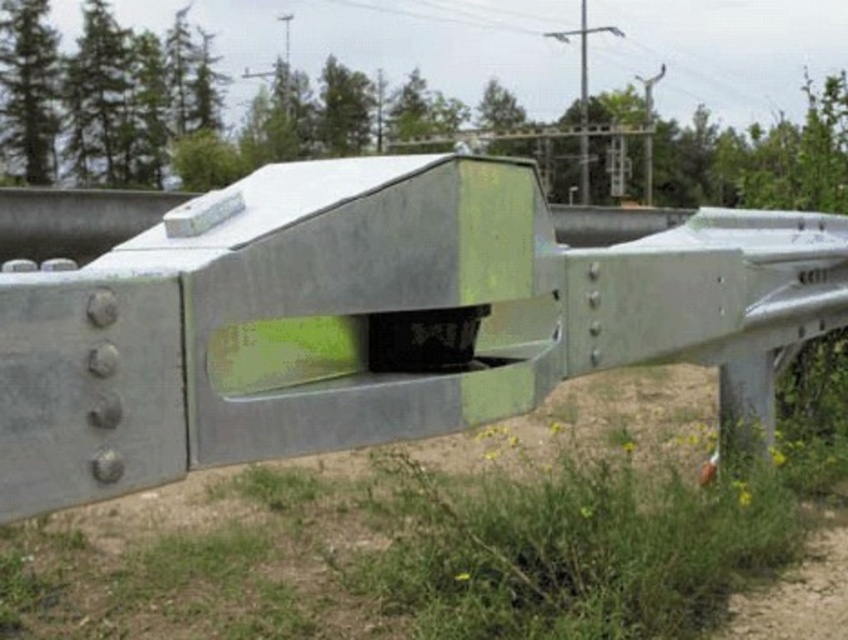
Does dirt track at lower center appear over green grass at lower right?

No.

Is dirt track at lower center below green grass at lower right?

Indeed, dirt track at lower center is positioned under green grass at lower right.

Locate an element on the screen. Image resolution: width=848 pixels, height=640 pixels. dirt track at lower center is located at coordinates (455, 536).

At what (x,y) coordinates should I click in order to perform the action: click on dirt track at lower center. Please return your answer as a coordinate pair (x, y). This screenshot has width=848, height=640. Looking at the image, I should click on (455, 536).

Who is more distant from viewer, (548,392) or (706,621)?

Positioned behind is point (706,621).

Between green matte metal rail at center and dirt track at lower center, which one has more height?

Standing taller between the two is green matte metal rail at center.

At what (x,y) coordinates should I click in order to perform the action: click on green matte metal rail at center. Please return your answer as a coordinate pair (x, y). This screenshot has height=640, width=848. Looking at the image, I should click on (375, 321).

Find the location of a particular element. Image resolution: width=848 pixels, height=640 pixels. green matte metal rail at center is located at coordinates (375, 321).

From the picture: Is green matte metal rail at center to the left of green grass at lower right from the viewer's perspective?

Incorrect, green matte metal rail at center is not on the left side of green grass at lower right.

Is point (328, 316) farther from viewer compared to point (528, 513)?

No, (328, 316) is closer to viewer.

Between point (512, 300) and point (395, 586), which one is positioned behind?

Positioned behind is point (395, 586).

Image resolution: width=848 pixels, height=640 pixels. Identify the location of green matte metal rail at center. (375, 321).